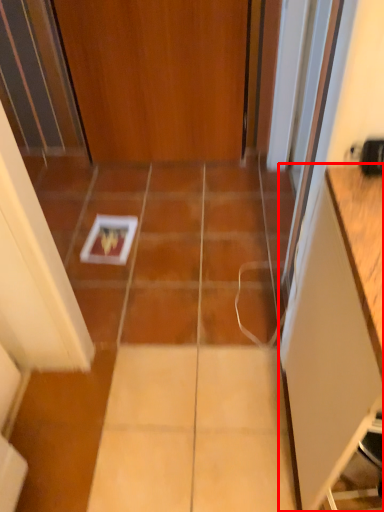
Question: Considering the relative positions of cabinetry (annotated by the red box) and door in the image provided, where is cabinetry (annotated by the red box) located with respect to the staircase?

Choices:
 (A) left
 (B) right

Answer: (B)